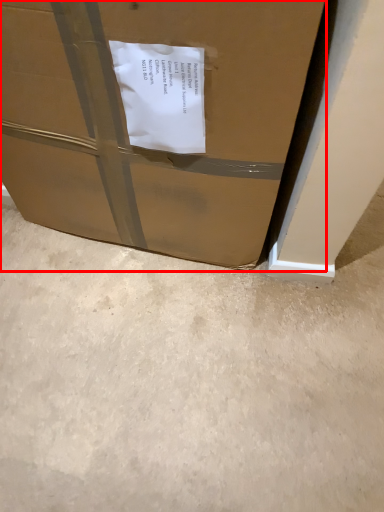
Question: Considering the relative positions of box (annotated by the red box) and concrete in the image provided, where is box (annotated by the red box) located with respect to the staircase?

Choices:
 (A) right
 (B) left

Answer: (B)